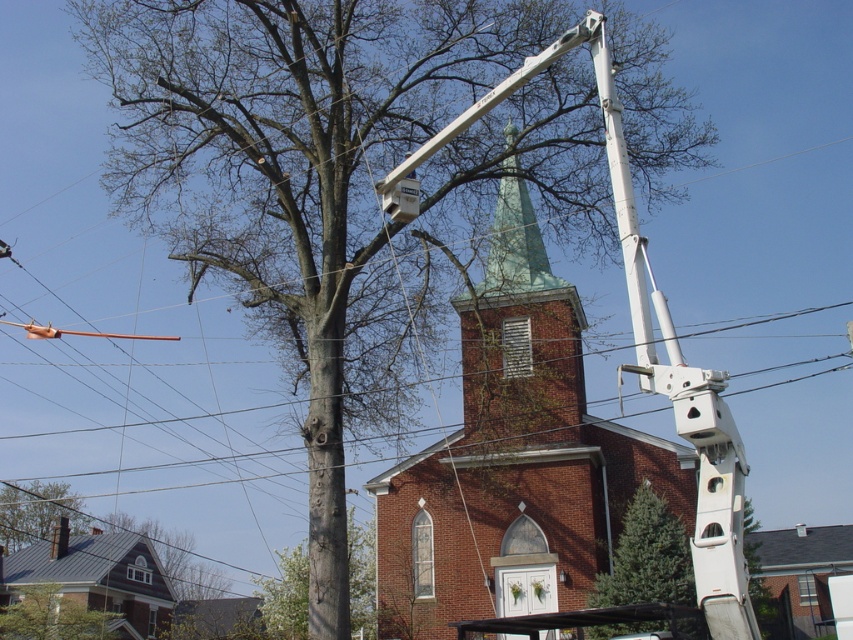
Between brick church at center and metallic gray roof at lower left, which one appears on the left side from the viewer's perspective?

From the viewer's perspective, metallic gray roof at lower left appears more on the left side.

Is brick church at center smaller than metallic gray roof at lower left?

Incorrect, brick church at center is not smaller in size than metallic gray roof at lower left.

Does point (550, 330) lie in front of point (108, 595)?

Yes.

The height and width of the screenshot is (640, 853). Find the location of `brick church at center`. brick church at center is located at coordinates (544, 461).

Does smooth gray tree trunk at lower left appear on the right side of smooth gray chimney at lower left?

Yes, smooth gray tree trunk at lower left is to the right of smooth gray chimney at lower left.

Is point (51, 632) positioned before point (73, 506)?

Yes, it is.

Find the location of `smooth gray tree trunk at lower left`. smooth gray tree trunk at lower left is located at coordinates (51, 616).

Does point (13, 556) lie in front of point (18, 540)?

Yes, point (13, 556) is closer to viewer.

Which of these two, metallic gray roof at lower left or smooth gray chimney at lower left, stands shorter?

metallic gray roof at lower left

Where is `metallic gray roof at lower left`? metallic gray roof at lower left is located at coordinates (96, 577).